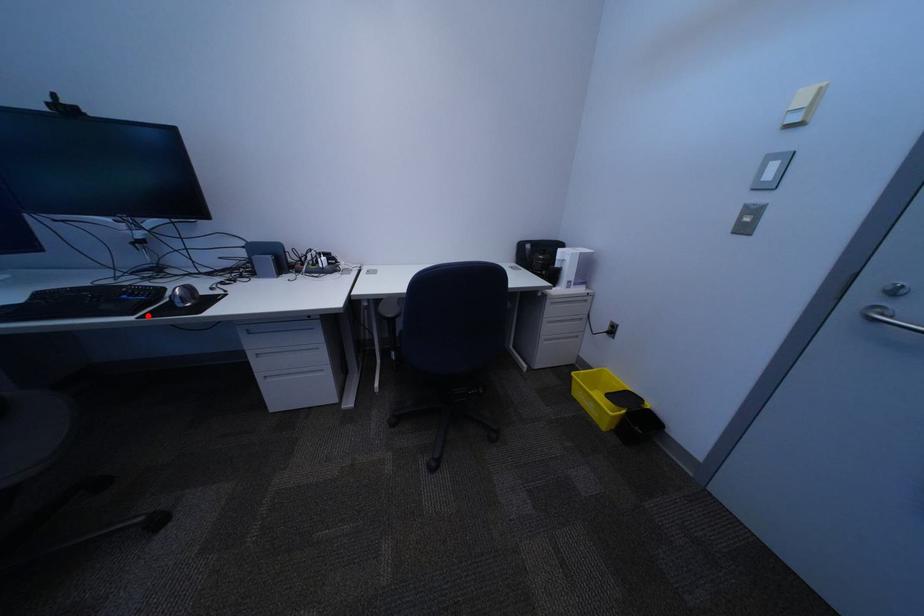
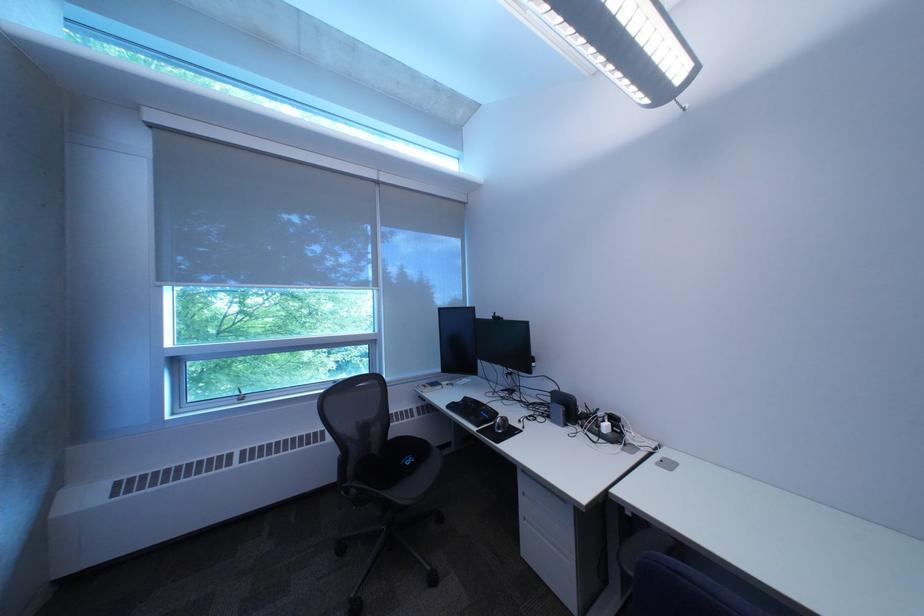
Find the pixel in the second image that matches the highlighted location in the first image.

(492, 429)